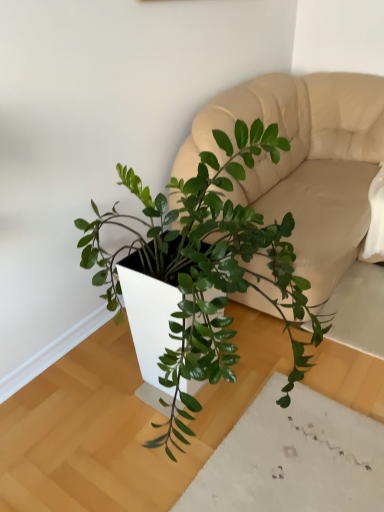
Question: Should I look upward or downward to see green glossy plant at center?

Choices:
 (A) up
 (B) down

Answer: (B)

Question: Is green glossy plant at center further to the viewer compared to beige leather couch at center?

Choices:
 (A) yes
 (B) no

Answer: (B)

Question: Considering the relative sizes of green glossy plant at center and beige leather couch at center in the image provided, is green glossy plant at center taller than beige leather couch at center?

Choices:
 (A) yes
 (B) no

Answer: (A)

Question: Is green glossy plant at center positioned in front of beige leather couch at center?

Choices:
 (A) no
 (B) yes

Answer: (B)

Question: Does green glossy plant at center have a smaller size compared to beige leather couch at center?

Choices:
 (A) yes
 (B) no

Answer: (A)

Question: Is green glossy plant at center outside beige leather couch at center?

Choices:
 (A) yes
 (B) no

Answer: (A)

Question: Is beige leather couch at center at the back of green glossy plant at center?

Choices:
 (A) yes
 (B) no

Answer: (B)

Question: Considering the relative sizes of beige leather couch at center and green glossy plant at center in the image provided, is beige leather couch at center smaller than green glossy plant at center?

Choices:
 (A) no
 (B) yes

Answer: (A)

Question: Is beige leather couch at center wider than green glossy plant at center?

Choices:
 (A) no
 (B) yes

Answer: (B)

Question: Is beige leather couch at center positioned with its back to green glossy plant at center?

Choices:
 (A) no
 (B) yes

Answer: (A)

Question: Is beige leather couch at center shorter than green glossy plant at center?

Choices:
 (A) yes
 (B) no

Answer: (A)

Question: Is the position of beige leather couch at center less distant than that of green glossy plant at center?

Choices:
 (A) yes
 (B) no

Answer: (B)

Question: Is beige leather couch at center to the left of green glossy plant at center from the viewer's perspective?

Choices:
 (A) no
 (B) yes

Answer: (A)

Question: In the image, is green glossy plant at center positioned in front of or behind beige leather couch at center?

Choices:
 (A) behind
 (B) front

Answer: (B)